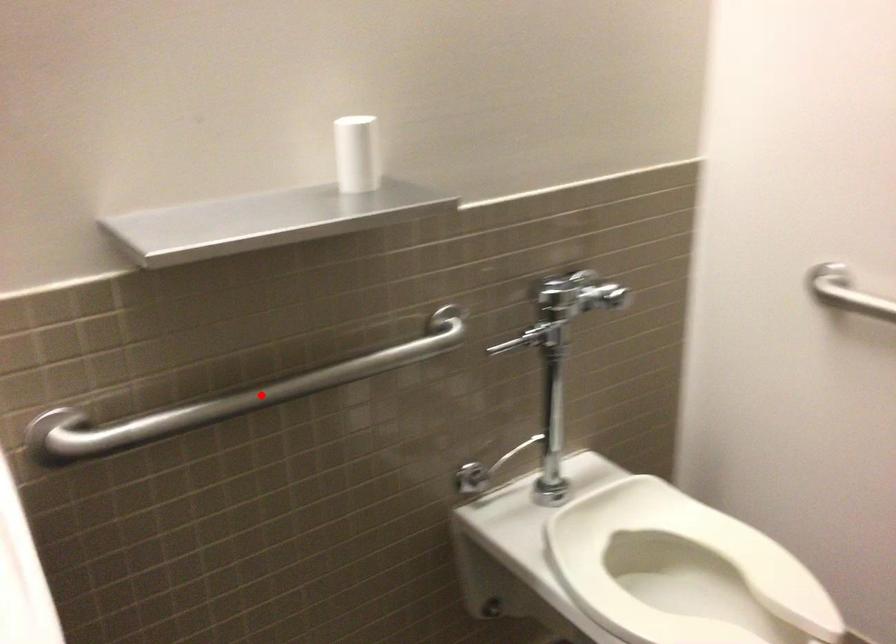
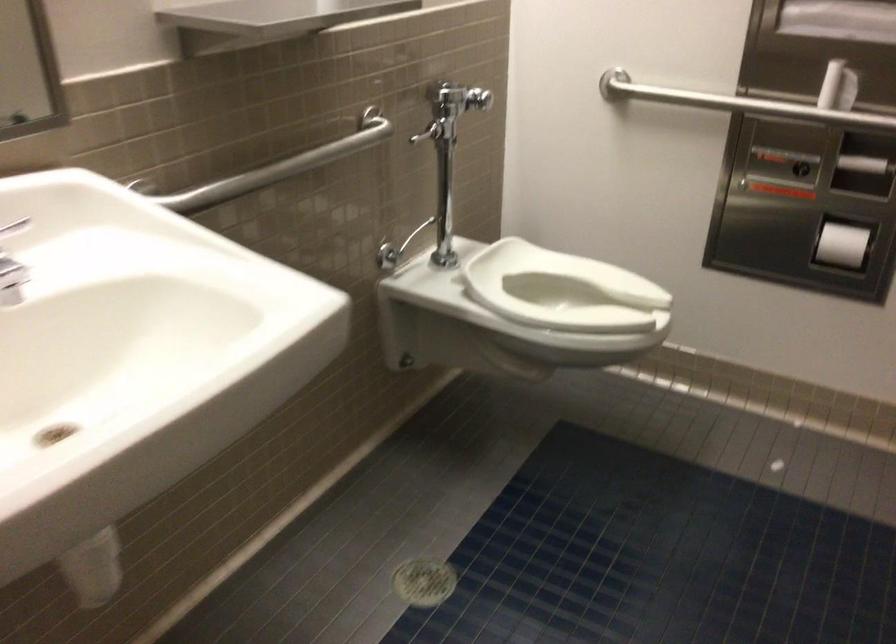
Question: I am providing you with two images of the same scene from different viewpoints. In image1, a red point is highlighted. Considering the same 3D point in image2, which of the following is correct?

Choices:
 (A) It is closer
 (B) It is farther

Answer: (B)